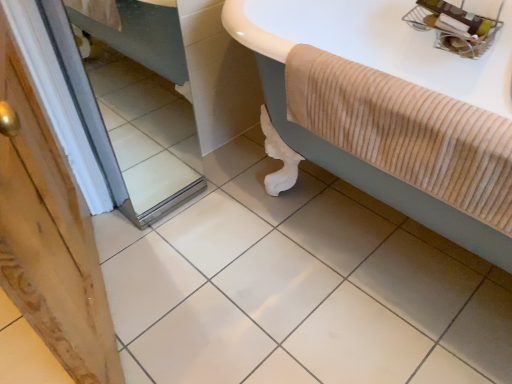
Question: Does white glossy ceramic tile at center have a smaller size compared to beige corduroy bathtub at upper right?

Choices:
 (A) no
 (B) yes

Answer: (A)

Question: Is white glossy ceramic tile at center turned away from beige corduroy bathtub at upper right?

Choices:
 (A) no
 (B) yes

Answer: (A)

Question: Can you confirm if white glossy ceramic tile at center is taller than beige corduroy bathtub at upper right?

Choices:
 (A) no
 (B) yes

Answer: (A)

Question: From a real-world perspective, does white glossy ceramic tile at center sit lower than beige corduroy bathtub at upper right?

Choices:
 (A) yes
 (B) no

Answer: (A)

Question: Is white glossy ceramic tile at center touching beige corduroy bathtub at upper right?

Choices:
 (A) no
 (B) yes

Answer: (A)

Question: Considering the relative positions of beige corduroy bathtub at upper right and mirror at left in the image provided, is beige corduroy bathtub at upper right to the left or to the right of mirror at left?

Choices:
 (A) left
 (B) right

Answer: (B)

Question: Considering the positions of beige corduroy bathtub at upper right and mirror at left in the image, is beige corduroy bathtub at upper right taller or shorter than mirror at left?

Choices:
 (A) short
 (B) tall

Answer: (A)

Question: Is beige corduroy bathtub at upper right wider or thinner than mirror at left?

Choices:
 (A) thin
 (B) wide

Answer: (A)

Question: Is beige corduroy bathtub at upper right inside or outside of mirror at left?

Choices:
 (A) outside
 (B) inside

Answer: (A)

Question: From a real-world perspective, is beige corduroy bathtub at upper right positioned above or below white glossy ceramic tile at center?

Choices:
 (A) above
 (B) below

Answer: (A)

Question: Is point (420, 46) positioned closer to the camera than point (132, 226)?

Choices:
 (A) farther
 (B) closer

Answer: (B)

Question: From their relative heights in the image, would you say beige corduroy bathtub at upper right is taller or shorter than white glossy ceramic tile at center?

Choices:
 (A) tall
 (B) short

Answer: (A)

Question: Relative to white glossy ceramic tile at center, is beige corduroy bathtub at upper right in front or behind?

Choices:
 (A) front
 (B) behind

Answer: (B)

Question: Based on their sizes in the image, would you say mirror at left is bigger or smaller than beige corduroy bathtub at upper right?

Choices:
 (A) big
 (B) small

Answer: (A)

Question: Is mirror at left in front of or behind beige corduroy bathtub at upper right in the image?

Choices:
 (A) front
 (B) behind

Answer: (B)